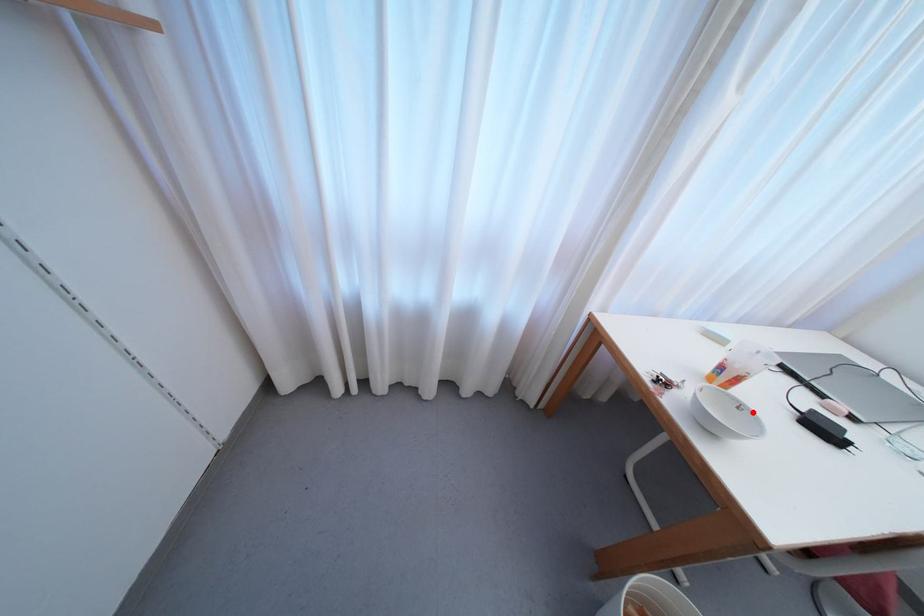
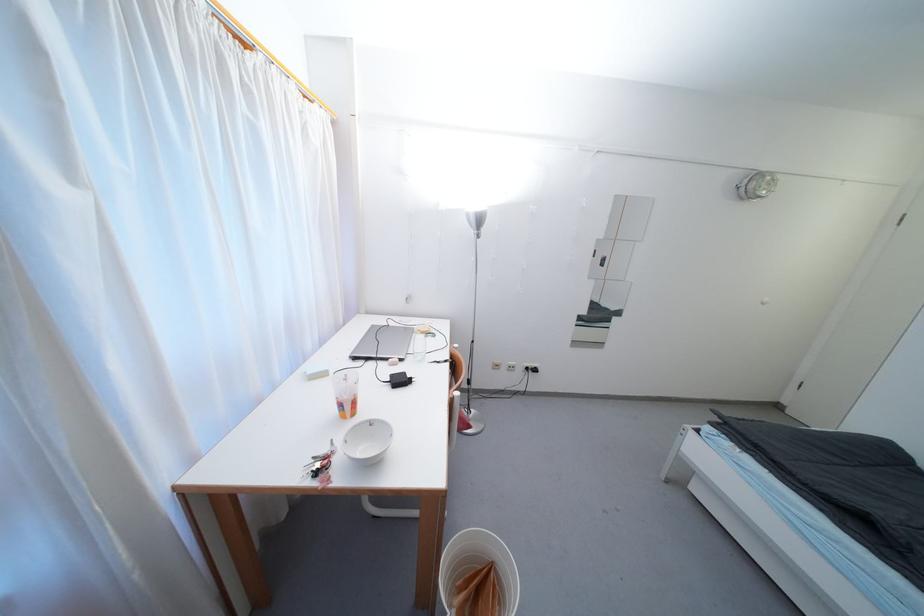
Where in the second image is the point corresponding to the highlighted location from the first image?

(379, 423)